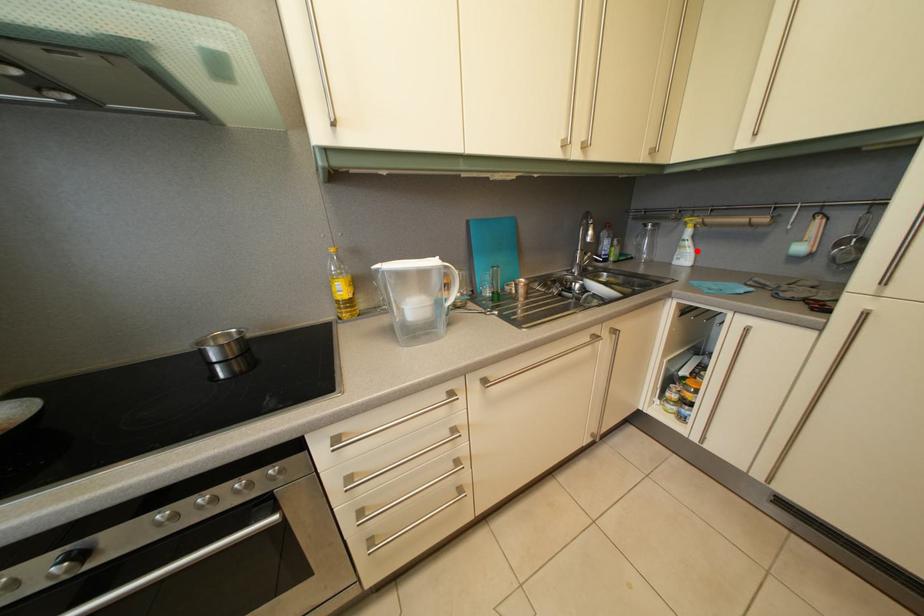
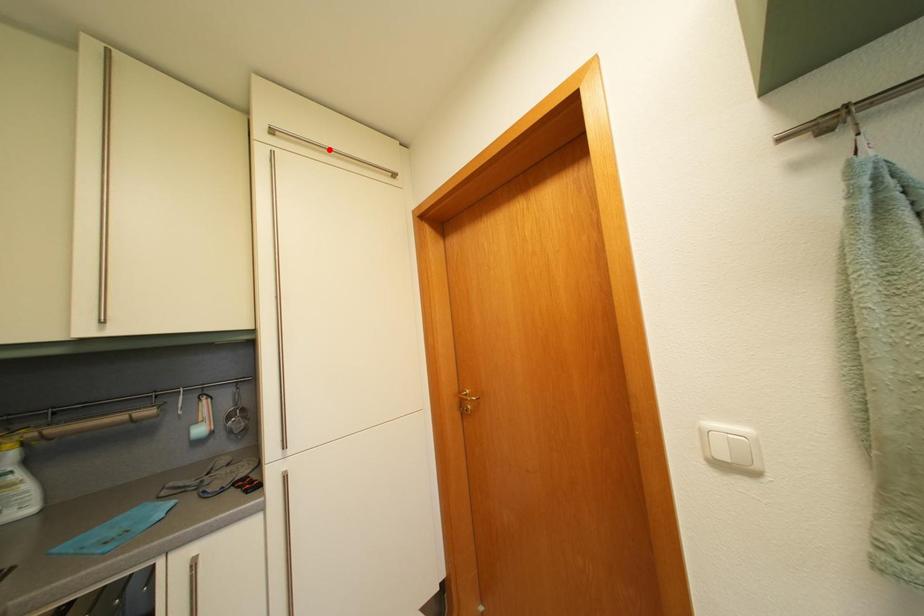
I am providing you with two images of the same scene from different viewpoints. A red point is marked on the first image and another point is marked on the second image. Is the red point in image1 aligned with the point shown in image2?

No